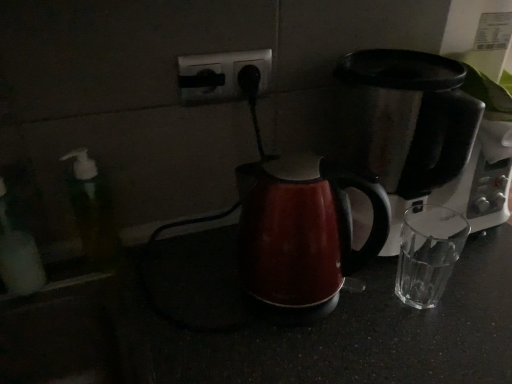
At what (x,y) coordinates should I click in order to perform the action: click on free point above glossy plastic kettle at center (from a real-world perspective). Please return your answer as a coordinate pair (x, y). The height and width of the screenshot is (384, 512). Looking at the image, I should click on (305, 168).